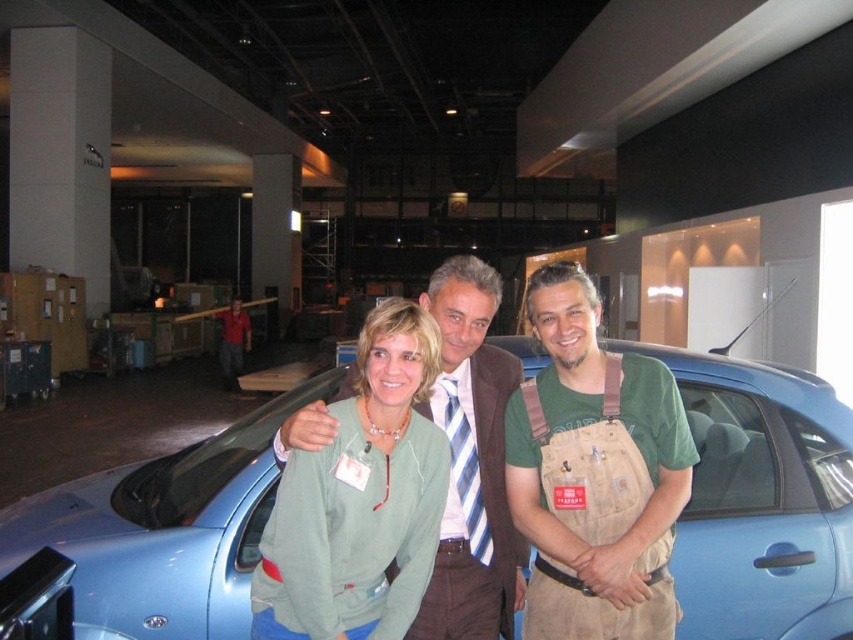
Question: Does green cotton hoodie at center have a larger size compared to green fabric jacket at center?

Choices:
 (A) no
 (B) yes

Answer: (B)

Question: Which is farther from the blue matte car at center?

Choices:
 (A) green cotton hoodie at center
 (B) green fabric jacket at center

Answer: (A)

Question: Observing the image, what is the correct spatial positioning of blue matte car at center in reference to green fabric jacket at center?

Choices:
 (A) left
 (B) right

Answer: (A)

Question: Estimate the real-world distances between objects in this image. Which object is closer to the blue matte car at center?

Choices:
 (A) green cotton hoodie at center
 (B) green canvas overalls at center
 (C) green fabric jacket at center

Answer: (C)

Question: Does blue matte car at center have a smaller size compared to green canvas overalls at center?

Choices:
 (A) no
 (B) yes

Answer: (A)

Question: Which object is closer to the camera taking this photo?

Choices:
 (A) green fabric jacket at center
 (B) green canvas overalls at center
 (C) green cotton hoodie at center
 (D) blue matte car at center

Answer: (A)